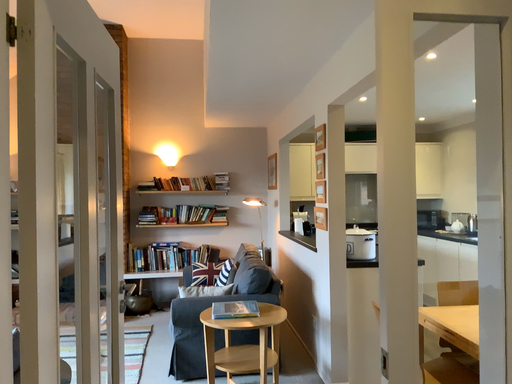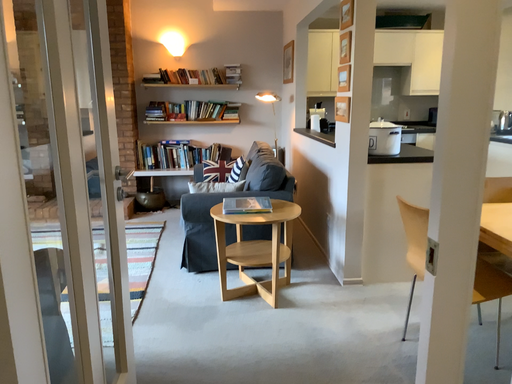
Question: How did the camera likely rotate when shooting the video?

Choices:
 (A) rotated downward
 (B) rotated upward

Answer: (A)